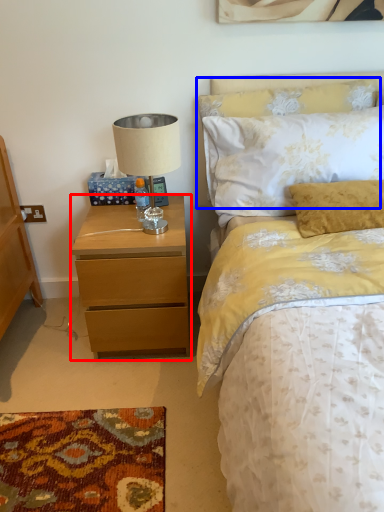
Question: Among these objects, which one is farthest to the camera, nightstand (highlighted by a red box) or pillow (highlighted by a blue box)?

Choices:
 (A) nightstand
 (B) pillow

Answer: (B)